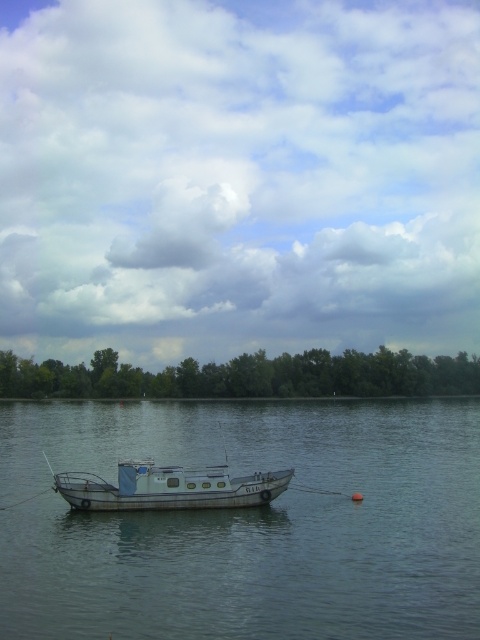
Question: Which object is positioned closest to the smooth gray water at center?

Choices:
 (A) white matte boat at center
 (B) cloudy sky at upper center

Answer: (A)

Question: Which point is farther to the camera?

Choices:
 (A) (46, 406)
 (B) (142, 502)
 (C) (375, 340)

Answer: (C)

Question: Which is farther from the white matte boat at center?

Choices:
 (A) cloudy sky at upper center
 (B) smooth gray water at center

Answer: (A)

Question: Can you confirm if smooth gray water at center is positioned to the left of white matte boat at center?

Choices:
 (A) yes
 (B) no

Answer: (B)

Question: Does cloudy sky at upper center appear on the right side of white matte boat at center?

Choices:
 (A) yes
 (B) no

Answer: (B)

Question: Can you confirm if cloudy sky at upper center is positioned above smooth gray water at center?

Choices:
 (A) no
 (B) yes

Answer: (B)